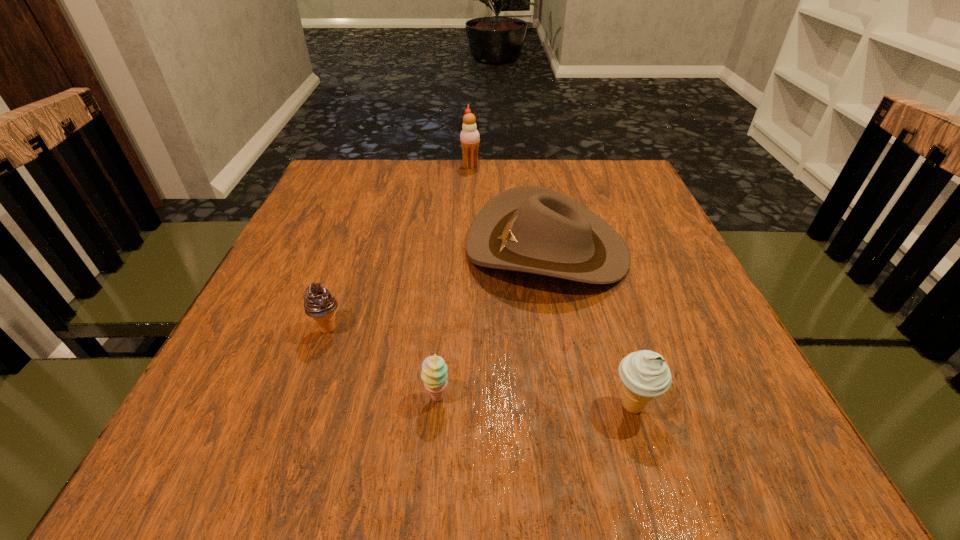
Where is `free spot that satisfies the following two spatial constraints: 1. with a star on the front of the rightmost icecream; 2. on the left side of the cowboy hat`? This screenshot has width=960, height=540. free spot that satisfies the following two spatial constraints: 1. with a star on the front of the rightmost icecream; 2. on the left side of the cowboy hat is located at coordinates (576, 407).

Where is `free space in the image that satisfies the following two spatial constraints: 1. on the front side of the third nearest object; 2. on the left side of the sherbert`? free space in the image that satisfies the following two spatial constraints: 1. on the front side of the third nearest object; 2. on the left side of the sherbert is located at coordinates (304, 397).

You are a GUI agent. You are given a task and a screenshot of the screen. Output one action in this format:
    pyautogui.click(x=<x>, y=<y>)
    Task: Click on the vacant space that satisfies the following two spatial constraints: 1. at the front with a straw on the second icecream from right to left; 2. on the right side of the rightmost icecream
    This screenshot has width=960, height=540.
    Given the screenshot: What is the action you would take?
    pyautogui.click(x=462, y=407)

Where is `free location that satisfies the following two spatial constraints: 1. on the front side of the second nearest icecream; 2. on the right side of the nearest icecream`? The image size is (960, 540). free location that satisfies the following two spatial constraints: 1. on the front side of the second nearest icecream; 2. on the right side of the nearest icecream is located at coordinates (301, 407).

The image size is (960, 540). Find the location of `vacant point that satisfies the following two spatial constraints: 1. with a star on the front of the rightmost icecream; 2. on the left side of the fourth nearest object`. vacant point that satisfies the following two spatial constraints: 1. with a star on the front of the rightmost icecream; 2. on the left side of the fourth nearest object is located at coordinates (576, 407).